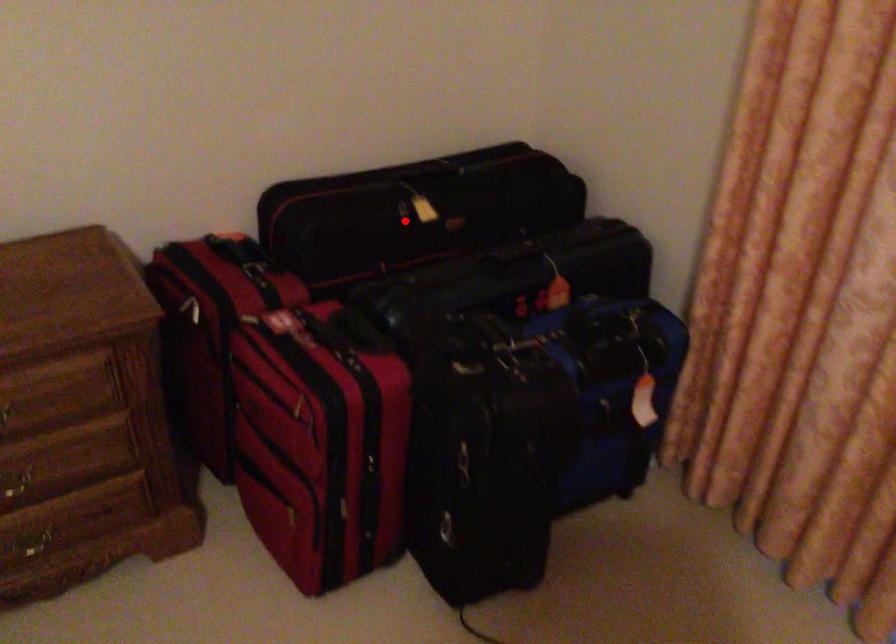
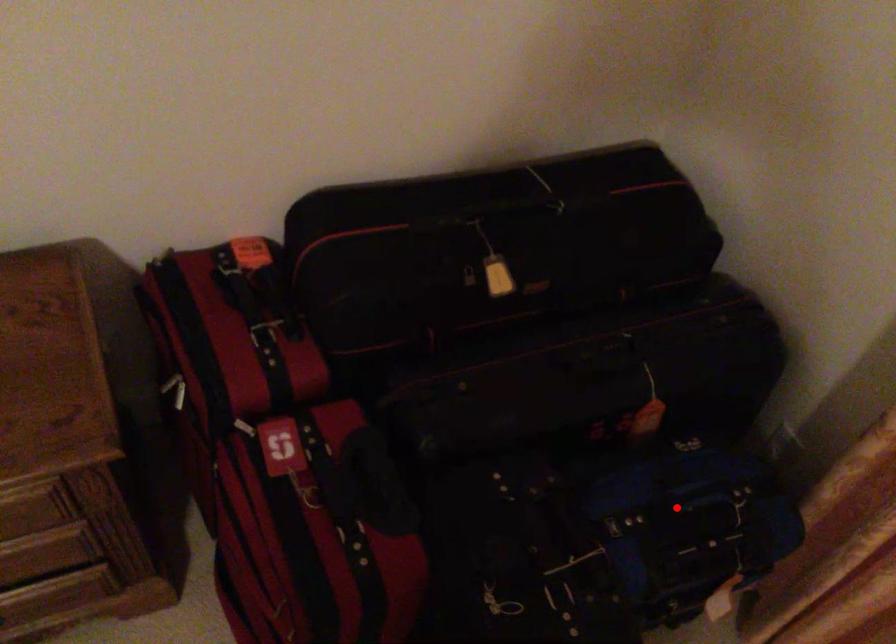
I am providing you with two images of the same scene from different viewpoints. A red point is marked on the first image and another point is marked on the second image. Does the point marked in image1 correspond to the same location as the one in image2?

No